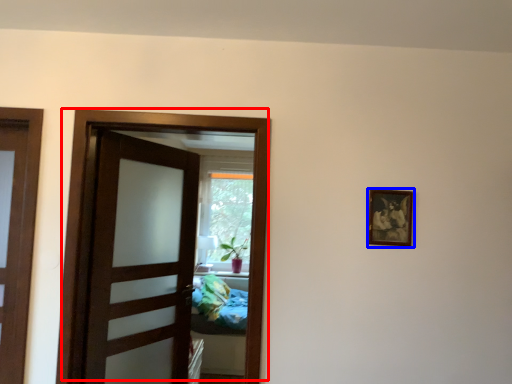
Question: Which of the following is the farthest to the observer, door (highlighted by a red box) or picture frame (highlighted by a blue box)?

Choices:
 (A) door
 (B) picture frame

Answer: (B)